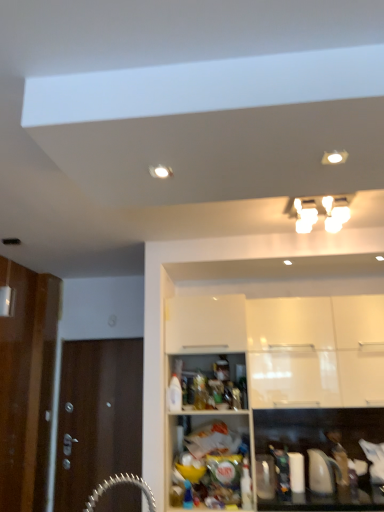
Question: Which is correct: brown wooden door at left is inside white glossy cabinet at upper center, the second cabinetry viewed from the back, or outside of it?

Choices:
 (A) inside
 (B) outside

Answer: (B)

Question: Considering the positions of brown wooden door at left and white glossy cabinet at upper center, the 1th cabinetry viewed from the front, in the image, is brown wooden door at left taller or shorter than white glossy cabinet at upper center, the 1th cabinetry viewed from the front,?

Choices:
 (A) tall
 (B) short

Answer: (B)

Question: Based on their relative distances, which object is farther from the white glossy cabinet at upper center, the second cabinetry viewed from the back?

Choices:
 (A) brown wooden door at left
 (B) white glossy light fixture at upper center
 (C) white glossy cabinet at upper right, arranged as the 2th cabinetry when viewed from the front
 (D) translucent plastic bottle at center

Answer: (A)

Question: Which object is the closest to the brown wooden door at left?

Choices:
 (A) white glossy light fixture at upper center
 (B) white glossy cabinet at upper center, the second cabinetry viewed from the back
 (C) translucent plastic bottle at center
 (D) white glossy cabinet at upper right, arranged as the 2th cabinetry when viewed from the front

Answer: (B)